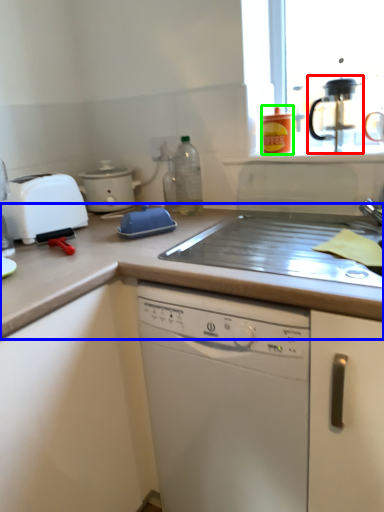
Question: Considering the real-world distances, which object is farthest from coffee machine (highlighted by a red box)? countertop (highlighted by a blue box) or kitchen appliance (highlighted by a green box)?

Choices:
 (A) countertop
 (B) kitchen appliance

Answer: (A)